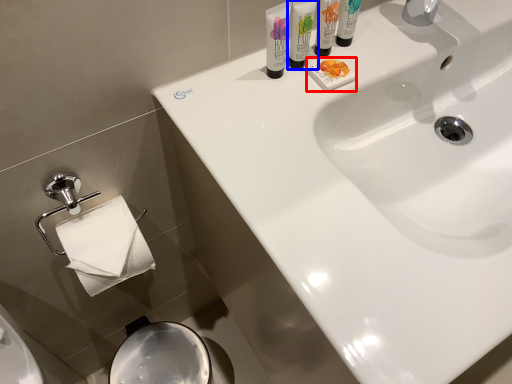
Question: Which object appears closest to the camera in this image, soap (highlighted by a red box) or shaving cream (highlighted by a blue box)?

Choices:
 (A) soap
 (B) shaving cream

Answer: (B)